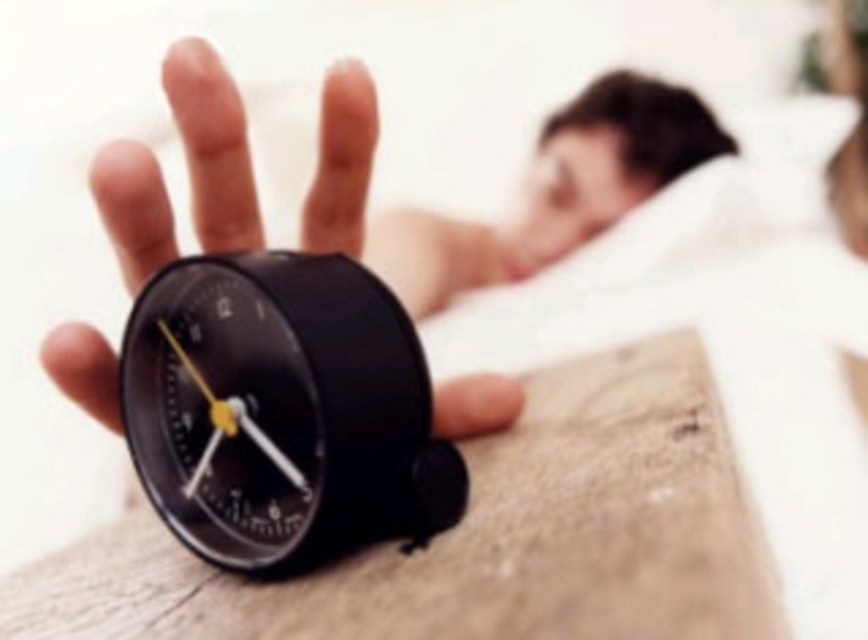
You are trying to determine which alarm clock is taller between the black plastic alarm clock at center and the matte black alarm clock at center. Based on the scene, which one is taller?

The matte black alarm clock at center is taller than the black plastic alarm clock at center.

You are a delivery person who just delivered two alarm clocks to a customer. The customer wants to place them on a shelf that is 1.2 meters wide. Can both the black plastic alarm clock at center and the matte black alarm clock at center fit side by side on the shelf?

The distance between the black plastic alarm clock at center and matte black alarm clock at center is 1.12 meters, which is less than the shelf width of 1.2 meters. Therefore, both alarm clocks can fit side by side on the shelf.

You are trying to place a small black plastic alarm clock at center on a shelf that is 0.5 meters wide. The shelf has a maximum load capacity of 2 kilograms. The alarm clock weighs 0.3 kilograms. Can the alarm clock be placed safely on the shelf?

The black plastic alarm clock at center weighs 0.3 kilograms, which is under the shelf capacity of 2 kilograms. However, the shelf is 0.5 meters wide and the alarm clock is at point (281,410) which may not fit. Please check the dimensions of the alarm clock and shelf width to ensure it fits.